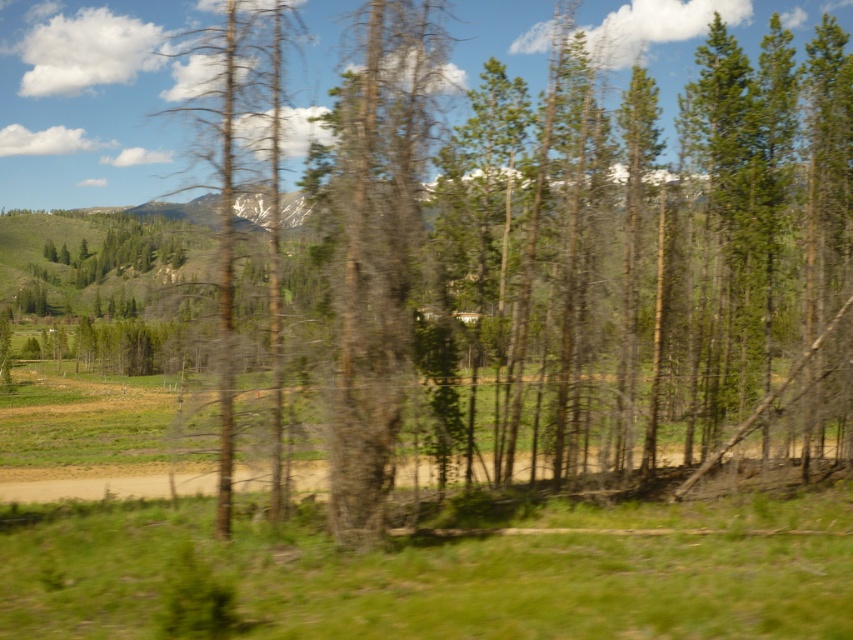
Question: Is brown dirt track at center to the left of dead bark tree at center from the viewer's perspective?

Choices:
 (A) no
 (B) yes

Answer: (A)

Question: Which of these objects is positioned closest to the brown dirt track at center?

Choices:
 (A) dead bark tree at center
 (B) gray bark tree at center

Answer: (A)

Question: Which of these objects is positioned farthest from the brown dirt track at center?

Choices:
 (A) gray bark tree at center
 (B) dead bark tree at center

Answer: (A)

Question: Is gray bark tree at center thinner than brown dirt track at center?

Choices:
 (A) no
 (B) yes

Answer: (B)

Question: Which point is closer to the camera?

Choices:
 (A) dead bark tree at center
 (B) brown dirt track at center
 (C) gray bark tree at center

Answer: (A)

Question: Can you confirm if brown dirt track at center is thinner than dead bark tree at center?

Choices:
 (A) yes
 (B) no

Answer: (B)